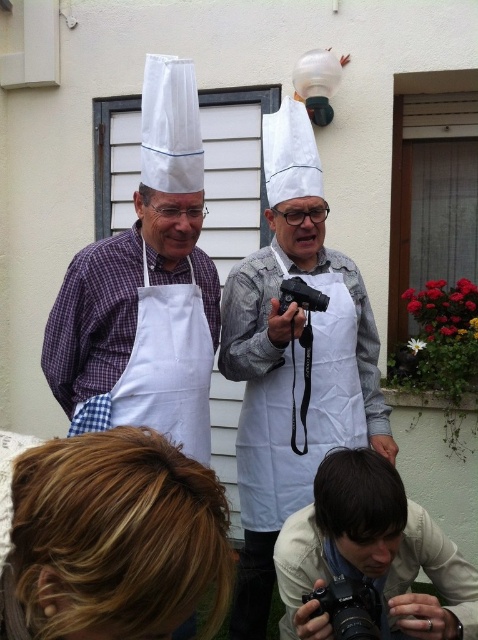
Question: Which point is closer to the camera?

Choices:
 (A) white fabric apron at left
 (B) matte white camera at center

Answer: (B)

Question: Which of the following is the farthest from the observer?

Choices:
 (A) (22, 560)
 (B) (167, 237)
 (C) (316, 292)

Answer: (C)

Question: Does white paper chef hat at center appear on the right side of matte white camera at center?

Choices:
 (A) no
 (B) yes

Answer: (A)

Question: Which object is farther from the camera taking this photo?

Choices:
 (A) blonde hair at lower left
 (B) white fabric apron at left
 (C) white paper chef hat at center

Answer: (C)

Question: Can you confirm if white paper chef hat at center is positioned above white matte apron at center?

Choices:
 (A) no
 (B) yes

Answer: (A)

Question: Does blonde hair at lower left appear under black rubber camera at center?

Choices:
 (A) yes
 (B) no

Answer: (A)